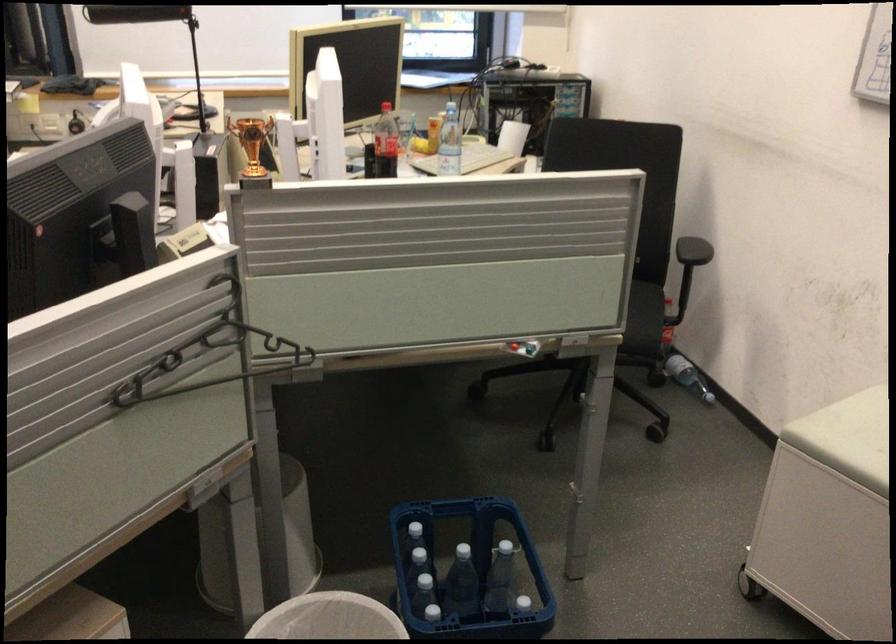
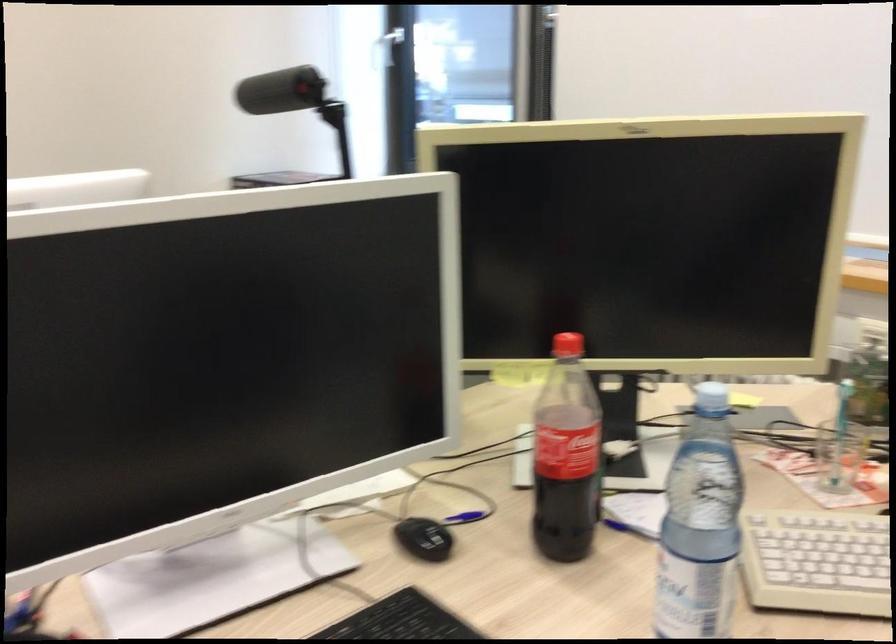
Where in the second image is the point corresponding to point 437,164 from the first image?

(815, 562)